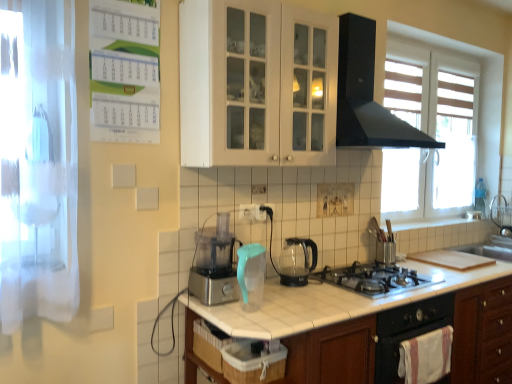
Question: From a real-world perspective, is black plastic electric outlet at center, the second electric outlet from the left, physically located above or below black matte range hood at upper center?

Choices:
 (A) above
 (B) below

Answer: (B)

Question: From the image's perspective, relative to black matte range hood at upper center, is black plastic electric outlet at center, which appears as the 1th electric outlet when viewed from the back, above or below?

Choices:
 (A) above
 (B) below

Answer: (B)

Question: Based on their relative distances, which object is nearer to the white tile countertop at center?

Choices:
 (A) stainless steel gas stove at center
 (B) white plastic electric outlet at center, the 1th electric outlet in the left-to-right sequence
 (C) transparent fabric screen door at left
 (D) black matte oven at lower right
 (E) white glass cabinet at upper center

Answer: (D)

Question: Which object is the closest to the transparent glass kettle at center?

Choices:
 (A) white glass cabinet at upper center
 (B) white plastic electric outlet at center, which is counted as the 1th electric outlet, starting from the front
 (C) white tile countertop at center
 (D) transparent fabric screen door at left
 (E) black plastic electric outlet at center, positioned as the 2th electric outlet in front-to-back order

Answer: (E)